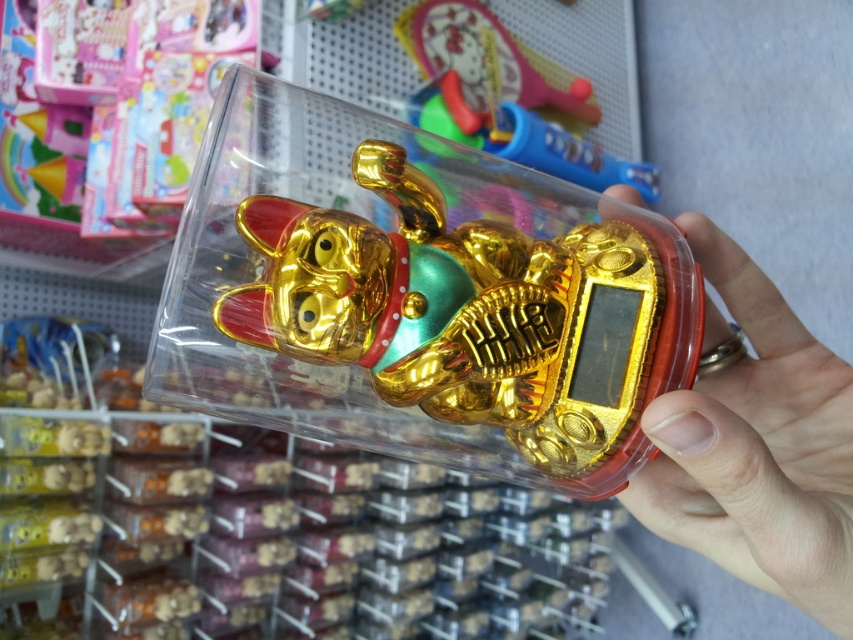
You are an assistant organizing a store display. You see the gold shiny lucky cat at center and the gold metallic hand at center. Which object is positioned to the left side of the other?

The gold shiny lucky cat at center is to the left of the gold metallic hand at center.

You are a store employee who needs to ensure that the gold shiny lucky cat at center and the gold metallic hand at center can fit into a display case that has a maximum width capacity of 15 cm. Given their sizes, can both items be placed side by side without exceeding the width limit?

The gold shiny lucky cat at center is wider than the gold metallic hand at center. However, without knowing their exact widths, we cannot determine if their combined width exceeds the 15 cm limit. Additional measurements are needed.

You are a store employee organizing items on a shelf. You have the gold shiny lucky cat at center and the gold metallic hand at center. Which item should you place first if you want to maximize shelf space efficiency?

You should place the gold shiny lucky cat at center first because it occupies less space than the gold metallic hand at center, allowing more room for other items.